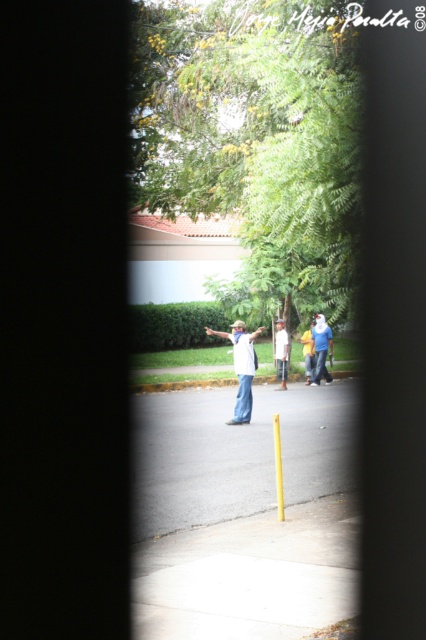
Is white cotton shirt at center thinner than blue denim jeans at center?

No.

This screenshot has width=426, height=640. What do you see at coordinates (241, 368) in the screenshot?
I see `white cotton shirt at center` at bounding box center [241, 368].

Is point (239, 394) closer to camera compared to point (307, 358)?

Yes, it is in front of point (307, 358).

Locate an element on the screen. Image resolution: width=426 pixels, height=640 pixels. white cotton shirt at center is located at coordinates (241, 368).

Is yellow plastic pole at center smaller than blue denim jeans at center?

Indeed, yellow plastic pole at center has a smaller size compared to blue denim jeans at center.

Is point (282, 499) positioned after point (310, 333)?

No, (282, 499) is in front of (310, 333).

Locate an element on the screen. The width and height of the screenshot is (426, 640). yellow plastic pole at center is located at coordinates (278, 467).

Which is below, light blue denim jeans at center or blue denim jeans at center?

light blue denim jeans at center is lower down.

Is point (285, 356) behind point (313, 372)?

That is False.

At what (x,y) coordinates should I click in order to perform the action: click on light blue denim jeans at center. Please return your answer as a coordinate pair (x, y). The width and height of the screenshot is (426, 640). Looking at the image, I should click on (282, 353).